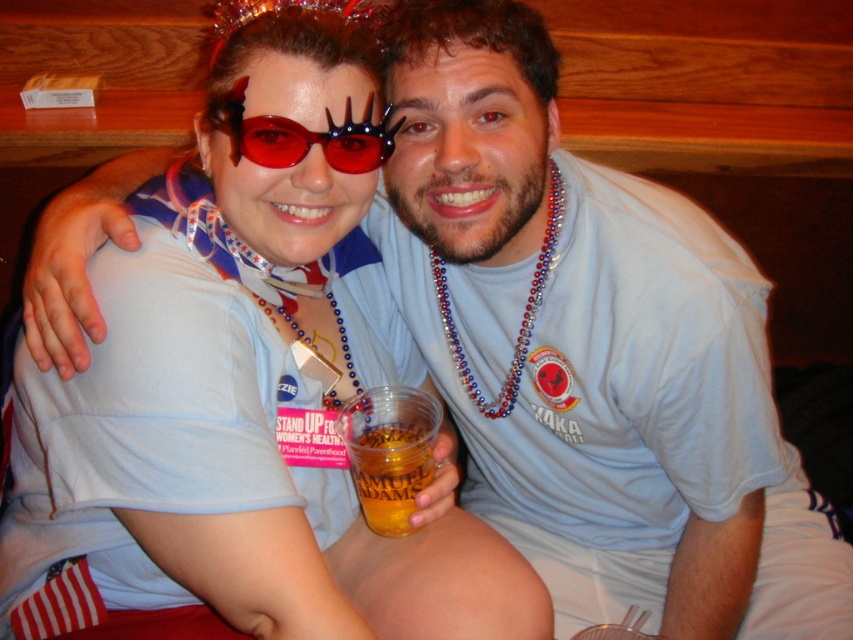
Question: Which point is closer to the camera taking this photo?

Choices:
 (A) (380, 429)
 (B) (231, 120)

Answer: (B)

Question: Is red plastic goggles at center wider than translucent plastic cup at lower center?

Choices:
 (A) yes
 (B) no

Answer: (A)

Question: Considering the relative positions of red plastic goggles at center and translucent plastic cup at lower center in the image provided, where is red plastic goggles at center located with respect to translucent plastic cup at lower center?

Choices:
 (A) left
 (B) right

Answer: (A)

Question: Observing the image, what is the correct spatial positioning of red plastic goggles at center in reference to translucent plastic cup at lower center?

Choices:
 (A) right
 (B) left

Answer: (B)

Question: Which point appears farthest from the camera in this image?

Choices:
 (A) coord(374,134)
 (B) coord(402,499)

Answer: (B)